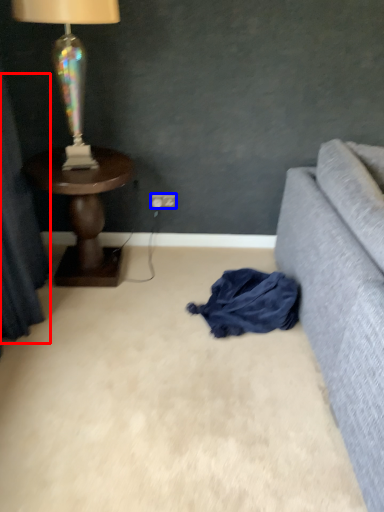
Question: Among these objects, which one is nearest to the camera, curtain (highlighted by a red box) or power outlet (highlighted by a blue box)?

Choices:
 (A) curtain
 (B) power outlet

Answer: (A)